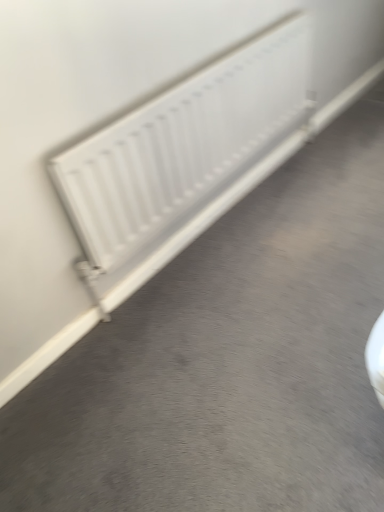
Where is `white matte radiator at center`? Image resolution: width=384 pixels, height=512 pixels. white matte radiator at center is located at coordinates (182, 148).

The height and width of the screenshot is (512, 384). What do you see at coordinates (182, 148) in the screenshot?
I see `white matte radiator at center` at bounding box center [182, 148].

Locate an element on the screen. white matte radiator at center is located at coordinates (182, 148).